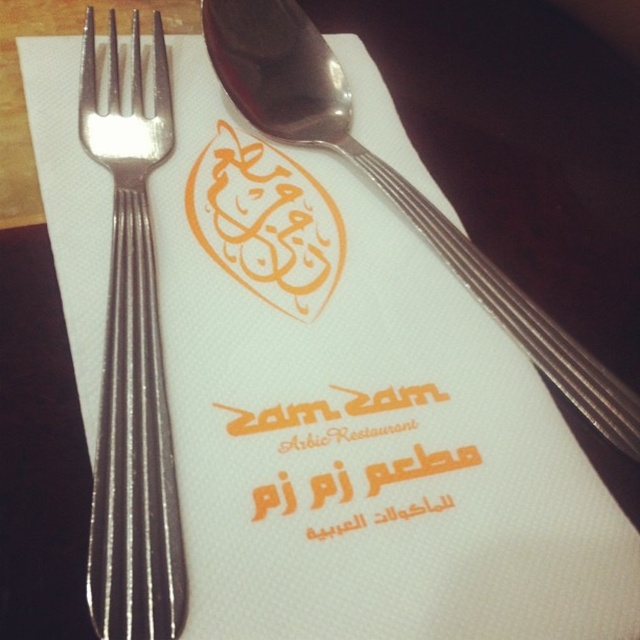
Question: Which is farther from the orange matte text at center?

Choices:
 (A) polished silver spoon at upper center
 (B) satin silver fork at left

Answer: (A)

Question: Does satin silver fork at left have a greater width compared to orange matte text at center?

Choices:
 (A) yes
 (B) no

Answer: (B)

Question: Which of the following is the closest to the observer?

Choices:
 (A) (248, 104)
 (B) (140, 198)

Answer: (B)

Question: Does satin silver fork at left have a larger size compared to polished silver spoon at upper center?

Choices:
 (A) yes
 (B) no

Answer: (B)

Question: Is orange matte text at center closer to camera compared to polished silver spoon at upper center?

Choices:
 (A) no
 (B) yes

Answer: (B)

Question: Which point is farther to the camera?

Choices:
 (A) satin silver fork at left
 (B) polished silver spoon at upper center
 (C) orange matte text at center

Answer: (B)